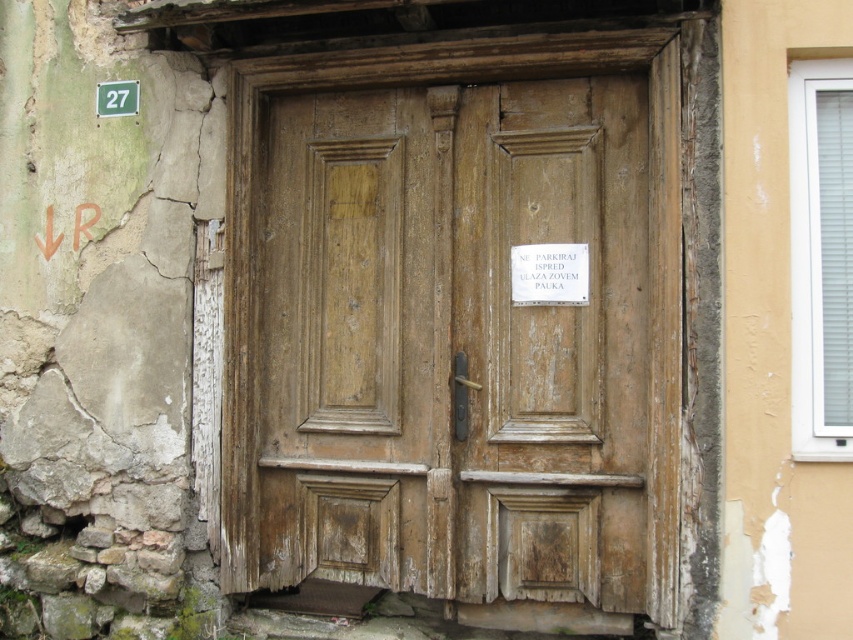
Is white paper sign at center further to camera compared to green plastic sign at upper left?

No, white paper sign at center is in front of green plastic sign at upper left.

Can you confirm if white paper sign at center is positioned to the left of green plastic sign at upper left?

In fact, white paper sign at center is to the right of green plastic sign at upper left.

Who is more forward, (521,276) or (117,84)?

Point (521,276) is in front.

You are a GUI agent. You are given a task and a screenshot of the screen. Output one action in this format:
    pyautogui.click(x=<x>, y=<y>)
    Task: Click on the white paper sign at center
    The height and width of the screenshot is (640, 853).
    Given the screenshot: What is the action you would take?
    pyautogui.click(x=549, y=275)

Does weathered wood door at center have a greater height compared to green plastic sign at upper left?

Yes, weathered wood door at center is taller than green plastic sign at upper left.

You are a GUI agent. You are given a task and a screenshot of the screen. Output one action in this format:
    pyautogui.click(x=<x>, y=<y>)
    Task: Click on the weathered wood door at center
    The image size is (853, 640).
    Given the screenshot: What is the action you would take?
    pyautogui.click(x=456, y=323)

Does weathered wood door at center have a lesser width compared to white paper sign at center?

No, weathered wood door at center is not thinner than white paper sign at center.

Who is more distant from viewer, (x=292, y=476) or (x=525, y=292)?

The point (x=292, y=476) is more distant.

Between point (508, 106) and point (525, 276), which one is positioned in front?

Point (525, 276) is more forward.

The height and width of the screenshot is (640, 853). Identify the location of weathered wood door at center. (456, 323).